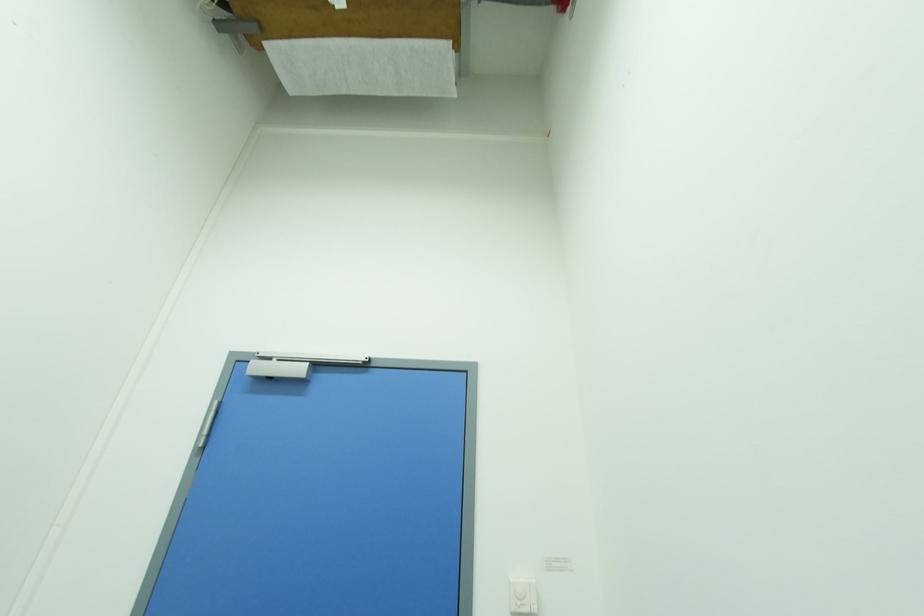
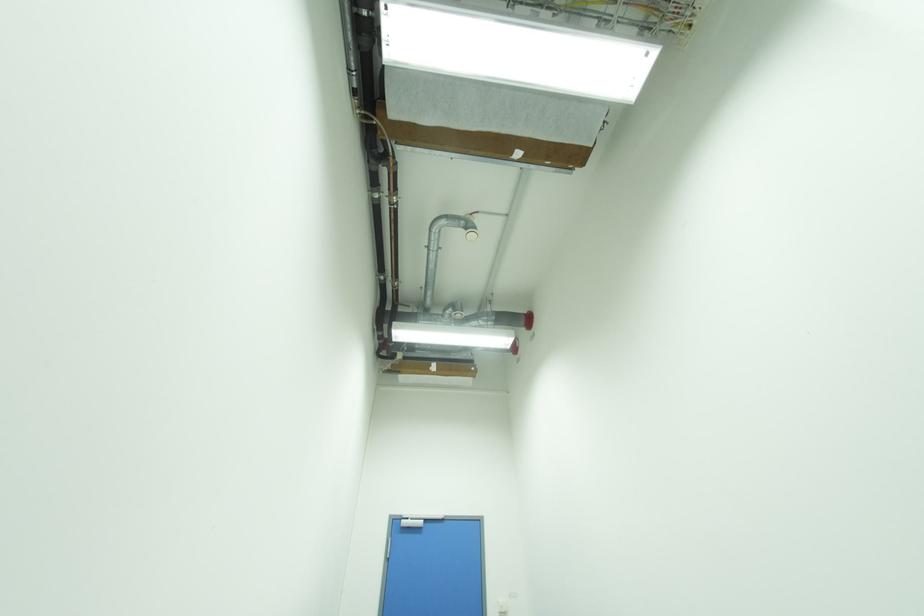
Question: The images are taken continuously from a first-person perspective. In which direction are you moving?

Choices:
 (A) Left
 (B) Right
 (C) Forward
 (D) Backward

Answer: (D)